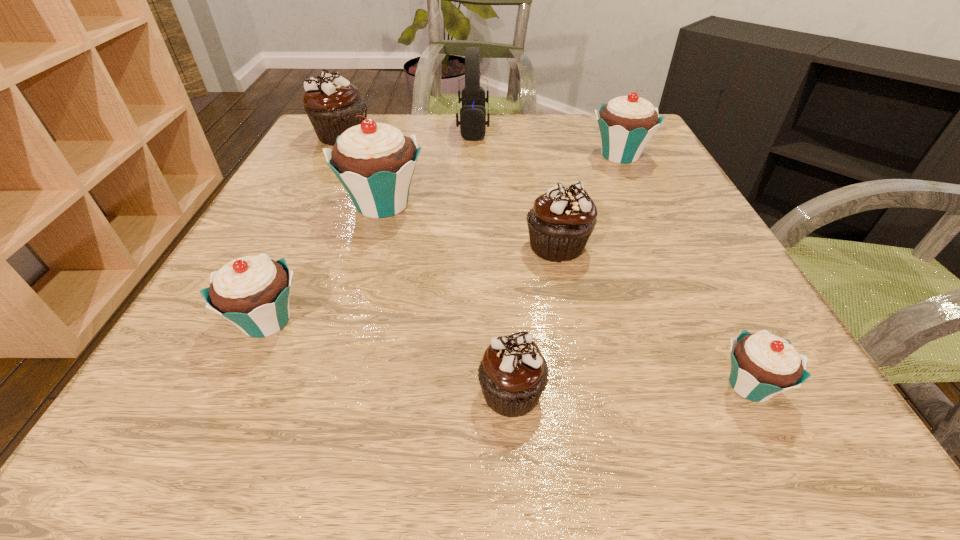
Where is `headset`? headset is located at coordinates (472, 122).

You are a GUI agent. You are given a task and a screenshot of the screen. Output one action in this format:
    pyautogui.click(x=<x>, y=<y>)
    Task: Click on the third nearest teal cupcake
    
    Given the screenshot: What is the action you would take?
    pyautogui.click(x=375, y=162)

This screenshot has height=540, width=960. I want to click on the biggest teal cupcake, so click(375, 162).

At what (x,y) coordinates should I click in order to perform the action: click on the leftmost brown cupcake. Please return your answer as a coordinate pair (x, y). The image size is (960, 540). Looking at the image, I should click on (331, 103).

What are the coordinates of `the biggest brown cupcake` in the screenshot? It's located at (331, 103).

What are the coordinates of `the second biggest teal cupcake` in the screenshot? It's located at (626, 124).

This screenshot has width=960, height=540. I want to click on the second smallest brown cupcake, so click(561, 220).

The width and height of the screenshot is (960, 540). Find the location of `the third nearest cupcake`. the third nearest cupcake is located at coordinates (252, 292).

Where is `the second nearest teal cupcake`? This screenshot has height=540, width=960. the second nearest teal cupcake is located at coordinates (252, 292).

Where is `the smallest brown cupcake`? the smallest brown cupcake is located at coordinates (513, 373).